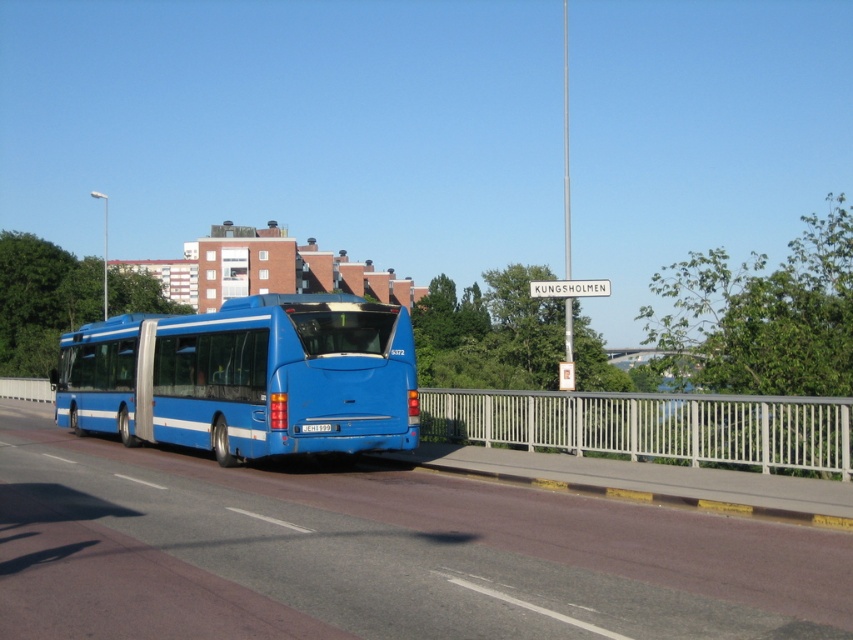
Describe the element at coordinates (247, 378) in the screenshot. I see `blue metallic bus at center` at that location.

Does blue metallic bus at center come behind metallic gray rail at center?

Yes, it is behind metallic gray rail at center.

Locate an element on the screen. This screenshot has width=853, height=640. blue metallic bus at center is located at coordinates (247, 378).

Can you confirm if blue metallic bus at center is thinner than white plastic street sign at upper center?

Yes.

Who is lower down, blue metallic bus at center or white plastic street sign at upper center?

blue metallic bus at center is below.

In order to click on blue metallic bus at center in this screenshot , I will do `click(247, 378)`.

Which is below, metallic gray rail at center or white plastic street sign at upper center?

metallic gray rail at center is below.

Between point (766, 465) and point (575, 280), which one is positioned in front?

Positioned in front is point (766, 465).

Locate an element on the screen. The width and height of the screenshot is (853, 640). metallic gray rail at center is located at coordinates (653, 426).